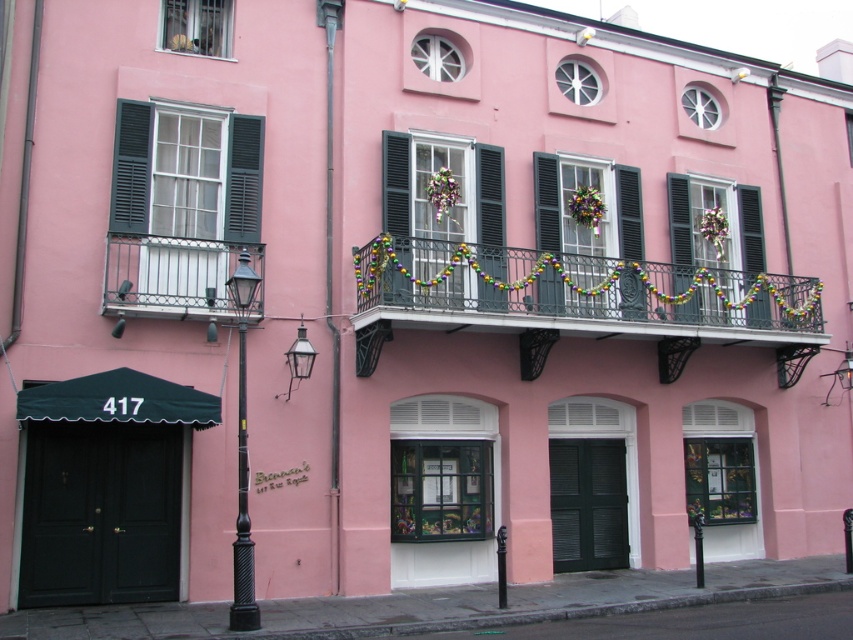
Which of these two, green matte shutter at center or multicolored fabric wreath at center, stands shorter?

→ Standing shorter between the two is multicolored fabric wreath at center.

Is green matte shutter at center shorter than multicolored fabric wreath at center?

Incorrect, green matte shutter at center's height does not fall short of multicolored fabric wreath at center's.

Locate an element on the screen. green matte shutter at center is located at coordinates (579, 221).

Where is `green matte shutter at center`? Image resolution: width=853 pixels, height=640 pixels. green matte shutter at center is located at coordinates (579, 221).

Between black matte shutters at upper left and black matte shutter at upper right, which one has more height?

With more height is black matte shutters at upper left.

Measure the distance between black matte shutters at upper left and camera.

The distance of black matte shutters at upper left from camera is 13.27 meters.

Find the location of a particular element. black matte shutters at upper left is located at coordinates (131, 168).

Does green matte shutter at center have a greater height compared to black matte shutters at upper left?

No.

This screenshot has width=853, height=640. Describe the element at coordinates (579, 221) in the screenshot. I see `green matte shutter at center` at that location.

Who is more forward, (573, 300) or (144, 188)?

Positioned in front is point (144, 188).

Where is `green matte shutter at center`? The width and height of the screenshot is (853, 640). green matte shutter at center is located at coordinates (579, 221).